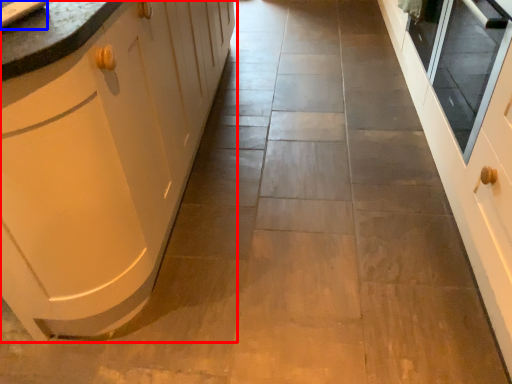
Question: Which of the following is the closest to the observer, cabinetry (highlighted by a red box) or sink (highlighted by a blue box)?

Choices:
 (A) cabinetry
 (B) sink

Answer: (A)